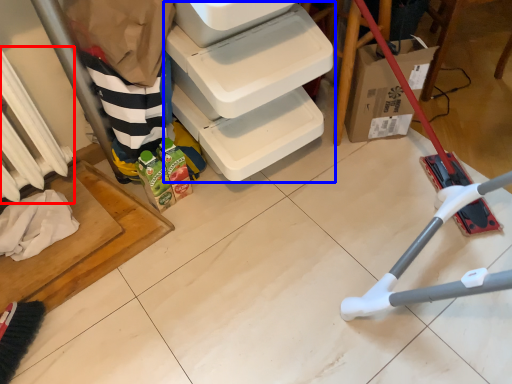
Question: Which of the following is the farthest to the observer, radiator (highlighted by a red box) or shelf (highlighted by a blue box)?

Choices:
 (A) radiator
 (B) shelf

Answer: (A)